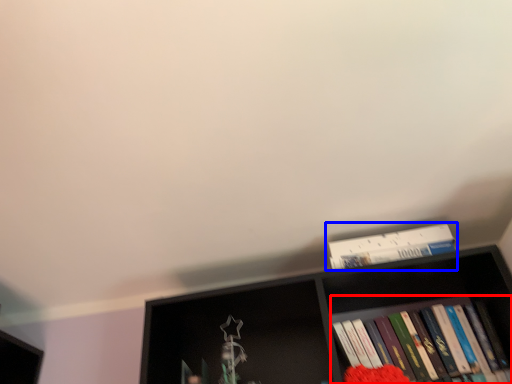
Question: Which of the following is the farthest to the observer, book (highlighted by a red box) or book (highlighted by a blue box)?

Choices:
 (A) book
 (B) book

Answer: (B)